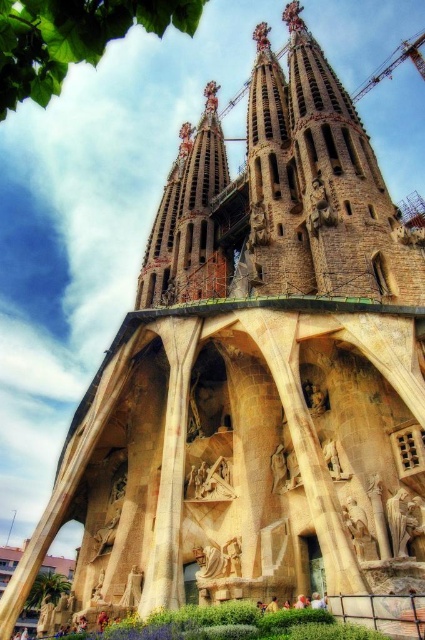
You are an architect visiting Sagrada Familia and want to compare the wooden carving at center and the stone statue at center. Which one is wider?

The wooden carving at center might be wider than stone statue at center.

You are standing in front of the Sagrada Familia and want to take a photo of the point at coordinates [212,477]. If your camera has a focal length of 50mm and you need the point to be exactly 100 meters away to capture it clearly, should you move closer or farther away?

The point at coordinates [212,477] is currently 76.98 meters away from you. Since you need it to be 100 meters away for clear capture, you should move farther away from the Sagrada Familia.

You are standing in front of the Sagrada Familia and notice two central elements. Which one is positioned to the left when looking at the wooden carving at center and the stone statue at center?

The wooden carving at center is positioned to the left of the stone statue at center.